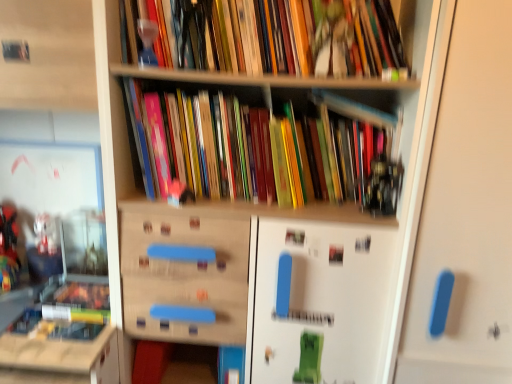
Question: Should I look upward or downward to see white matte door at right?

Choices:
 (A) down
 (B) up

Answer: (A)

Question: Which direction should I rotate to look at multicolored paperbacks at center, the 2th book in the top-to-bottom sequence?

Choices:
 (A) left
 (B) right

Answer: (B)

Question: From a real-world perspective, does hardcover books at upper center, which is the 2th book from bottom to top, stand above white matte door at right?

Choices:
 (A) no
 (B) yes

Answer: (B)

Question: Is hardcover books at upper center, which is the first book in top-to-bottom order, smaller than white matte door at right?

Choices:
 (A) yes
 (B) no

Answer: (A)

Question: Is hardcover books at upper center, which is the 2th book from bottom to top, looking in the opposite direction of white matte door at right?

Choices:
 (A) yes
 (B) no

Answer: (B)

Question: Are hardcover books at upper center, which is the 2th book from bottom to top, and white matte door at right located far from each other?

Choices:
 (A) no
 (B) yes

Answer: (A)

Question: Considering the relative positions of hardcover books at upper center, which is the first book in top-to-bottom order, and white matte door at right in the image provided, is hardcover books at upper center, which is the first book in top-to-bottom order, to the left of white matte door at right from the viewer's perspective?

Choices:
 (A) no
 (B) yes

Answer: (B)

Question: Does hardcover books at upper center, which is the first book in top-to-bottom order, turn towards white matte door at right?

Choices:
 (A) no
 (B) yes

Answer: (A)

Question: Is wooden bookshelf at left beside multicolored paperbacks at center, the first book in the bottom-to-top sequence?

Choices:
 (A) no
 (B) yes

Answer: (A)

Question: Is wooden bookshelf at left taller than multicolored paperbacks at center, the first book in the bottom-to-top sequence?

Choices:
 (A) yes
 (B) no

Answer: (A)

Question: Considering the relative sizes of wooden bookshelf at left and multicolored paperbacks at center, the 2th book in the top-to-bottom sequence, in the image provided, is wooden bookshelf at left shorter than multicolored paperbacks at center, the 2th book in the top-to-bottom sequence,?

Choices:
 (A) no
 (B) yes

Answer: (A)

Question: Is wooden bookshelf at left closer to the viewer compared to multicolored paperbacks at center, the 2th book in the top-to-bottom sequence?

Choices:
 (A) yes
 (B) no

Answer: (A)

Question: Is the position of wooden bookshelf at left more distant than that of multicolored paperbacks at center, the first book in the bottom-to-top sequence?

Choices:
 (A) no
 (B) yes

Answer: (A)

Question: Would you say wooden bookshelf at left is outside multicolored paperbacks at center, the 2th book in the top-to-bottom sequence?

Choices:
 (A) yes
 (B) no

Answer: (A)

Question: Is wooden bookshelf at left a part of hardcover books at upper center, which is the first book in top-to-bottom order?

Choices:
 (A) yes
 (B) no

Answer: (B)